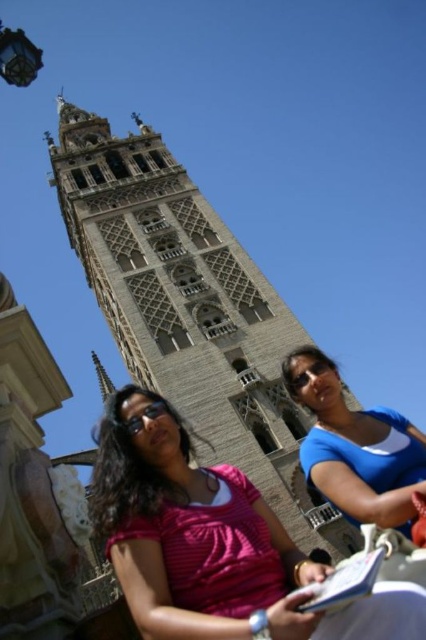
Question: Which object is positioned farthest from the blue fabric shirt at lower right?

Choices:
 (A) pink striped shirt at lower center
 (B) black matte goggles at lower center
 (C) stone tower at center

Answer: (C)

Question: Is stone tower at center thinner than pink striped shirt at lower center?

Choices:
 (A) no
 (B) yes

Answer: (A)

Question: Based on their relative distances, which object is farther from the black matte goggles at lower center?

Choices:
 (A) blue fabric shirt at lower right
 (B) stone tower at center

Answer: (B)

Question: Does stone tower at center have a lesser width compared to blue fabric shirt at lower right?

Choices:
 (A) yes
 (B) no

Answer: (B)

Question: Can you confirm if stone tower at center is positioned below black matte goggles at lower center?

Choices:
 (A) no
 (B) yes

Answer: (A)

Question: Which point is farther from the camera taking this photo?

Choices:
 (A) (126, 557)
 (B) (376, 513)
 (C) (216, 380)

Answer: (C)